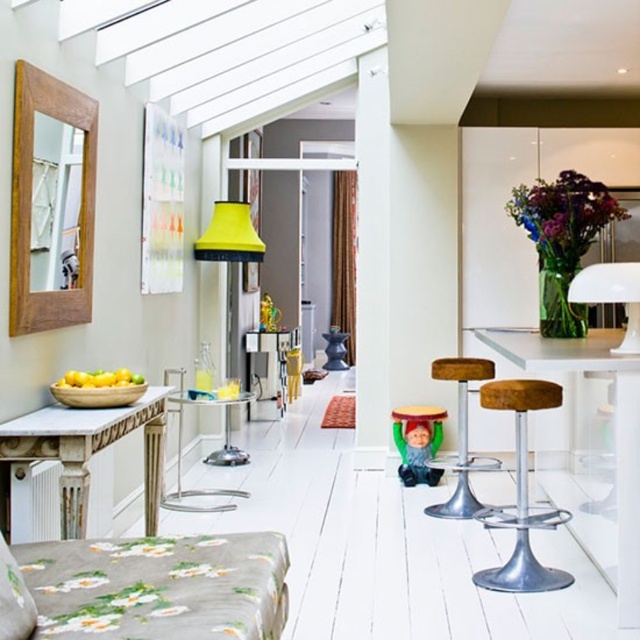
Question: Which point appears closest to the camera in this image?

Choices:
 (A) (442, 365)
 (B) (182, 496)
 (C) (424, 465)

Answer: (A)

Question: Which object is the closest to the brown leather stool at center?

Choices:
 (A) metallic silver bar stool at right
 (B) brown leather bar stool at right
 (C) white glossy table lamp at upper right

Answer: (B)

Question: Can you confirm if yellow fabric lampshade at center is wider than brown leather stool at center?

Choices:
 (A) no
 (B) yes

Answer: (B)

Question: Estimate the real-world distances between objects in this image. Which object is farther from the yellow fabric lampshade at center?

Choices:
 (A) brown leather bar stool at right
 (B) metallic silver bar stool at right
 (C) brown leather stool at center

Answer: (B)

Question: From the image, what is the correct spatial relationship of clear glass table at center in relation to brown leather stool at center?

Choices:
 (A) left
 (B) right

Answer: (A)

Question: Is metallic silver bar stool at right positioned at the back of white glossy table lamp at upper right?

Choices:
 (A) no
 (B) yes

Answer: (B)